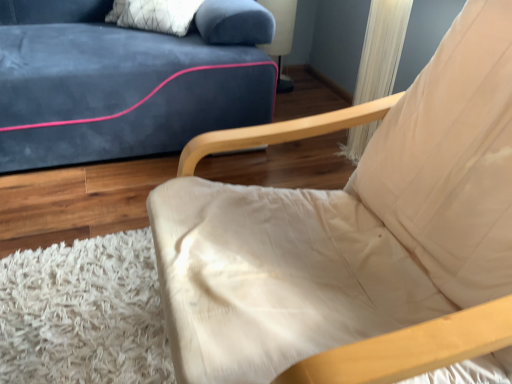
Question: Looking at their shapes, would you say beige fabric chair at center is wider or thinner than matte plastic table lamp at upper center?

Choices:
 (A) thin
 (B) wide

Answer: (B)

Question: Would you say beige fabric chair at center is inside or outside matte plastic table lamp at upper center?

Choices:
 (A) inside
 (B) outside

Answer: (B)

Question: From a real-world perspective, is beige fabric chair at center physically located above or below matte plastic table lamp at upper center?

Choices:
 (A) above
 (B) below

Answer: (A)

Question: From the image's perspective, is matte plastic table lamp at upper center above or below beige fabric chair at center?

Choices:
 (A) above
 (B) below

Answer: (A)

Question: From a real-world perspective, is matte plastic table lamp at upper center physically located above or below beige fabric chair at center?

Choices:
 (A) below
 (B) above

Answer: (A)

Question: Which is correct: matte plastic table lamp at upper center is inside beige fabric chair at center, or outside of it?

Choices:
 (A) outside
 (B) inside

Answer: (A)

Question: Is matte plastic table lamp at upper center taller or shorter than beige fabric chair at center?

Choices:
 (A) short
 (B) tall

Answer: (A)